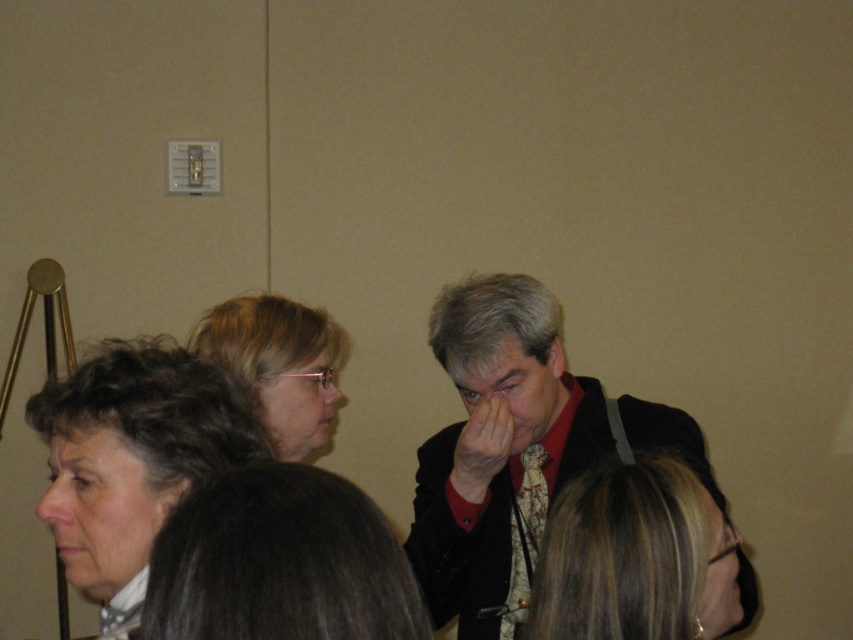
You are organizing a photo shoot and need to ensure that the dark red shirt at center and the blonde hair at center are at least 16 inches apart for proper framing. Based on the scene description, will their current positions meet this requirement?

The dark red shirt at center and the blonde hair at center are 15.17 inches apart from each other, which is less than the required 16 inches. Therefore, their current positions do not meet the requirement for proper framing.

Consider the image. In the scene described, there are two features visible at the lower left area. One is the dark brown hair at lower left and the other is the matte skin nose at lower left. Which of these two features is located higher up?

The dark brown hair at lower left is positioned over the matte skin nose at lower left, so the dark brown hair at lower left is higher up.